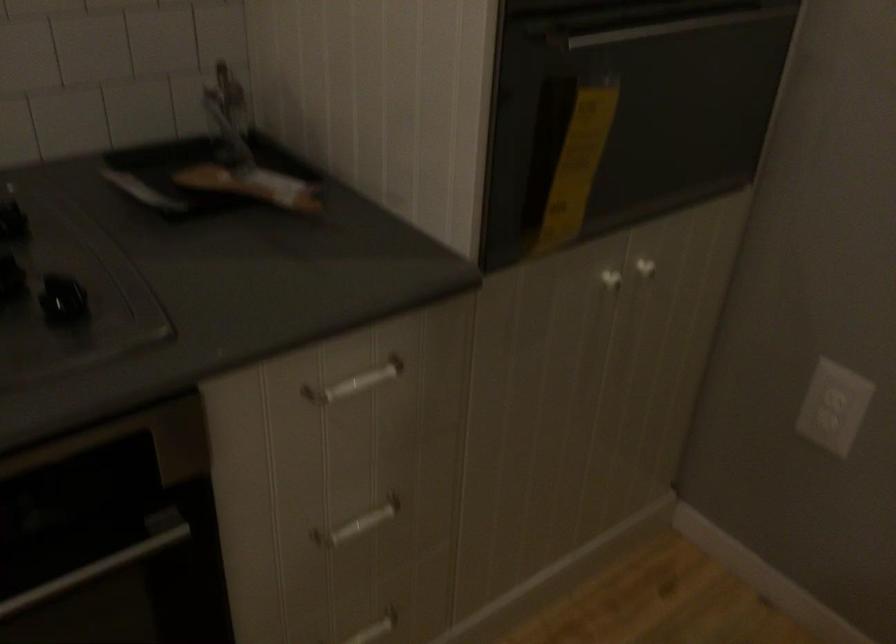
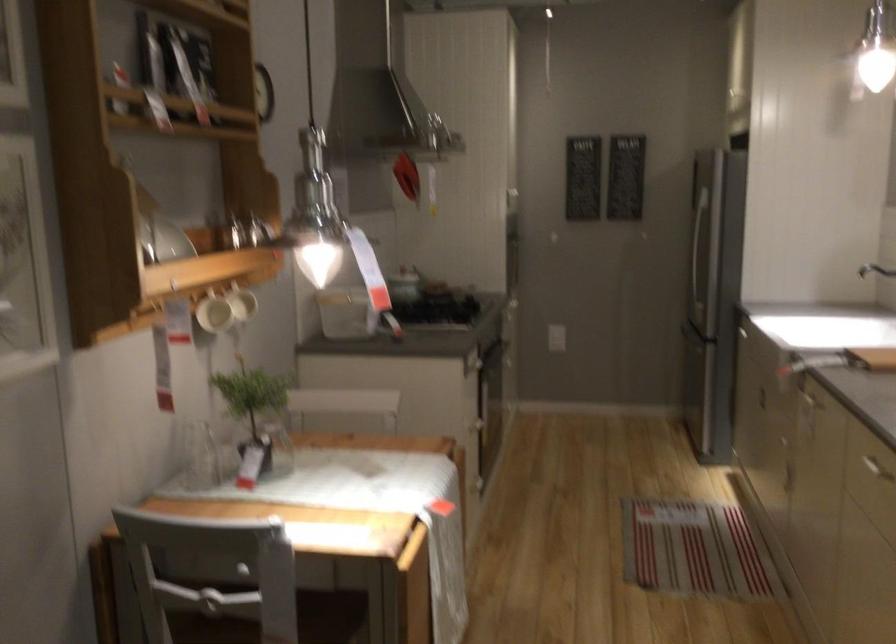
Question: I am providing you with two images of the same scene from different viewpoints. Please identify which objects are invisible in image2.

Choices:
 (A) sink faucet handle
 (B) orange food packet
 (C) metal oven handle
 (D) refrigerator door handle

Answer: (C)